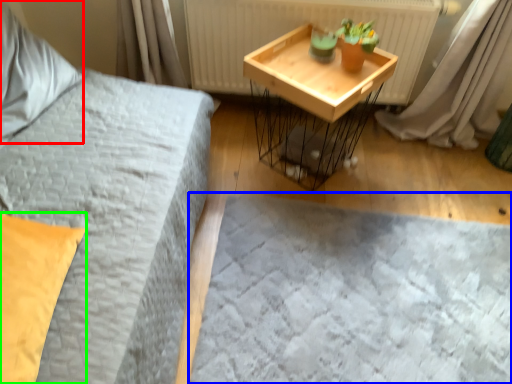
Question: Estimate the real-world distances between objects in this image. Which object is closer to pillow (highlighted by a red box), bed frame (highlighted by a blue box) or pillow (highlighted by a green box)?

Choices:
 (A) bed frame
 (B) pillow

Answer: (B)